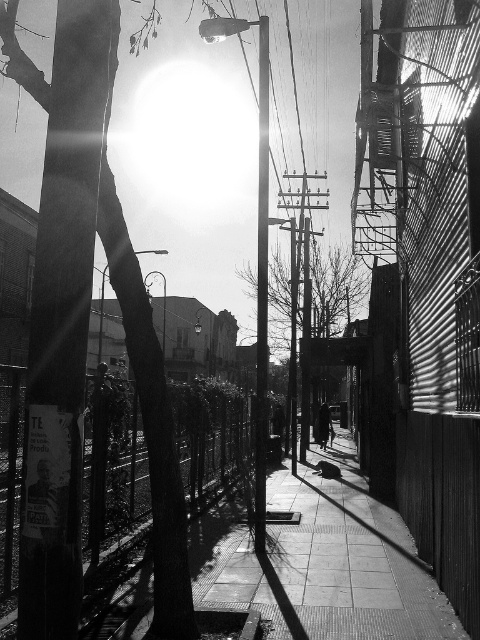
You are a delivery person who needs to place a large box on the ground. You see the smooth concrete pavement at center and the smooth metal pole at center. Which surface is shorter and suitable for placing the box?

The smooth concrete pavement at center is shorter than the smooth metal pole at center, so it is suitable for placing the box.

You are a delivery person who needs to walk from the sidewalk to the street. You see the smooth concrete pavement at center and the dark fabric coat at center. Which object is closer to the street?

The smooth concrete pavement at center is positioned on the left side of dark fabric coat at center, so the smooth concrete pavement at center is closer to the street.